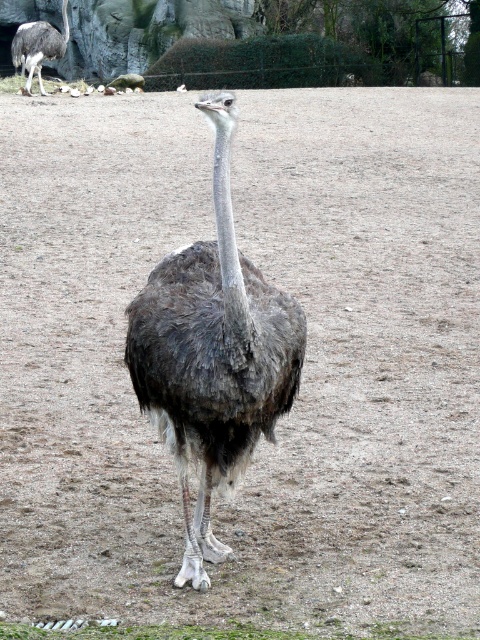
You are a visitor at the zoo and want to take a photo of the ostrich. You notice two points in the enclosure marked as point 1 at coordinates point 1 is at point (194, 337) and point 2 is at point (44, 40). If you want to stand closer to the ostrich, which point should you choose?

Point 1 at coordinates point (194, 337) is closer to the viewer than point 2 at coordinates point (44, 40), so you should choose point 1 to stand closer to the ostrich.